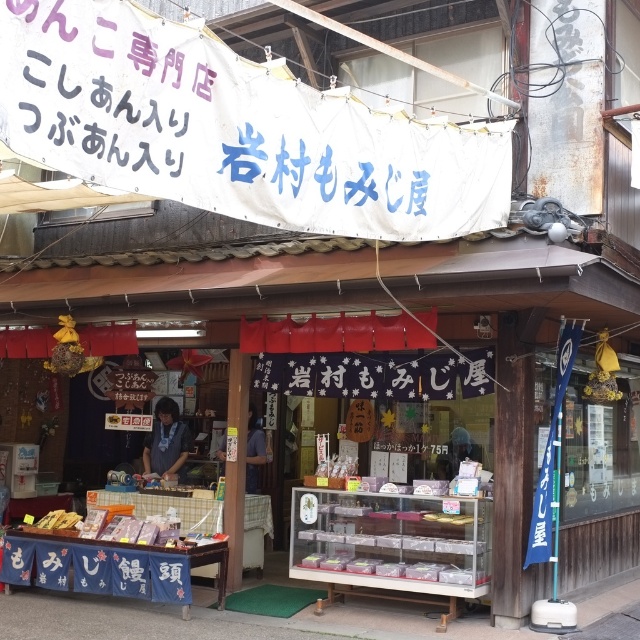
Question: From the image, what is the correct spatial relationship of white fabric banner at upper center in relation to blue fabric apron at center?

Choices:
 (A) above
 (B) below

Answer: (A)

Question: Estimate the real-world distances between objects in this image. Which object is closer to the blue fabric apron at center?

Choices:
 (A) matte white box at center
 (B) matte plastic box at center

Answer: (A)

Question: Which object is the farthest from the matte plastic box at center?

Choices:
 (A) matte white box at center
 (B) blue fabric apron at center
 (C) white fabric banner at upper center

Answer: (B)

Question: Can you confirm if white fabric banner at upper center is bigger than blue fabric apron at center?

Choices:
 (A) yes
 (B) no

Answer: (A)

Question: Can you confirm if blue fabric apron at center is positioned to the right of matte plastic box at center?

Choices:
 (A) yes
 (B) no

Answer: (B)

Question: Which object is the closest to the matte plastic box at center?

Choices:
 (A) blue fabric apron at center
 (B) white fabric banner at upper center

Answer: (B)